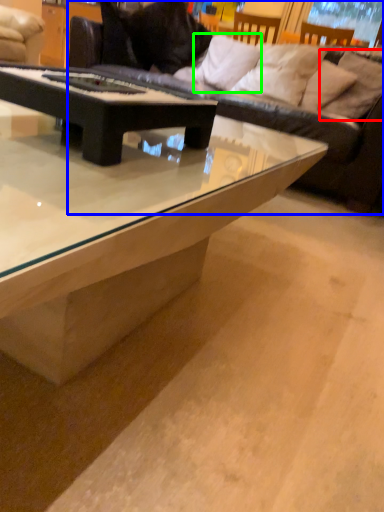
Question: Which object is the closest to the pillow (highlighted by a red box)? Choose among these: studio couch (highlighted by a blue box) or pillow (highlighted by a green box).

Choices:
 (A) studio couch
 (B) pillow

Answer: (A)